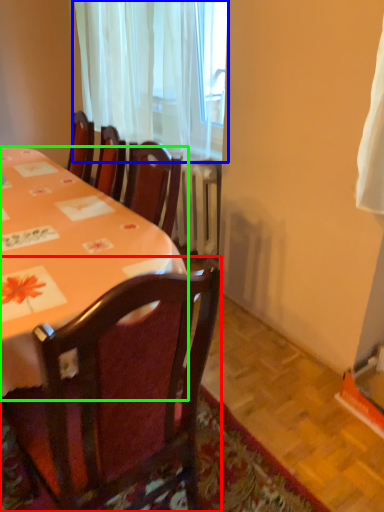
Question: Which object is the farthest from chair (highlighted by a red box)? Choose among these: curtain (highlighted by a blue box) or desk (highlighted by a green box).

Choices:
 (A) curtain
 (B) desk

Answer: (A)